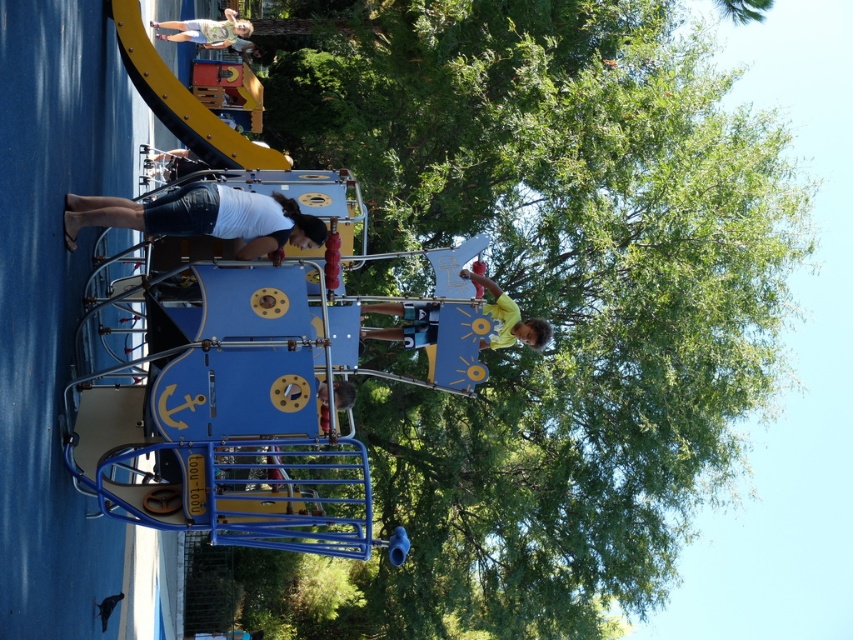
Question: Which of the following is the farthest from the observer?

Choices:
 (A) (389, 332)
 (B) (322, 392)
 (C) (254, 52)

Answer: (C)

Question: Observing the image, what is the correct spatial positioning of light green shirt at upper center in reference to smooth blue swing at center?

Choices:
 (A) below
 (B) above

Answer: (B)

Question: Is white cotton shorts at lower left to the right of smooth blue swing at center from the viewer's perspective?

Choices:
 (A) yes
 (B) no

Answer: (B)

Question: Estimate the real-world distances between objects in this image. Which object is closer to the metallic blue ship at center?

Choices:
 (A) white cotton shorts at lower left
 (B) yellow matte shirt at upper center
 (C) smooth blue swing at center

Answer: (A)

Question: Based on their relative distances, which object is nearer to the light green shirt at upper center?

Choices:
 (A) white cotton shorts at lower left
 (B) smooth blue swing at center
 (C) yellow matte shirt at upper center

Answer: (C)

Question: Can you confirm if metallic blue ship at center is smaller than yellow matte shirt at upper center?

Choices:
 (A) yes
 (B) no

Answer: (B)